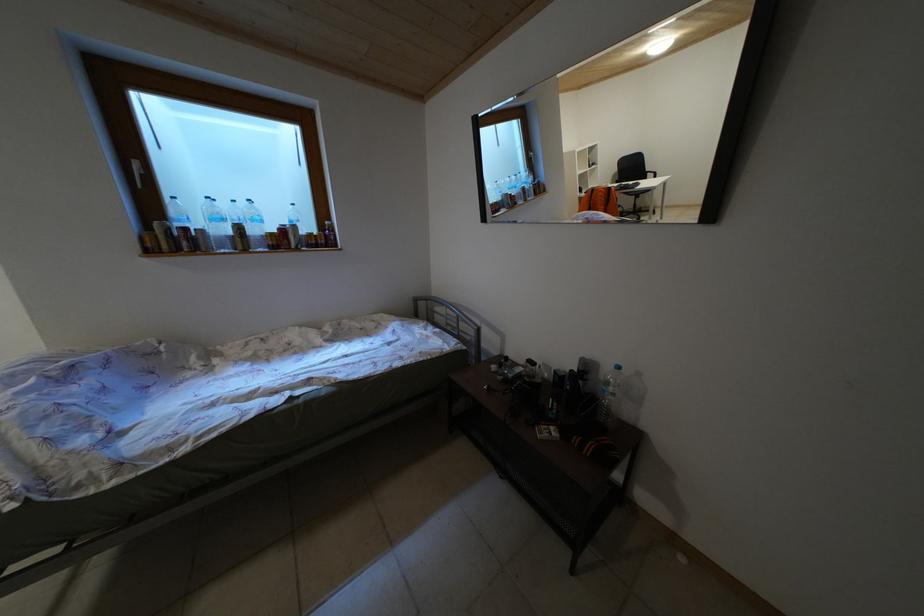
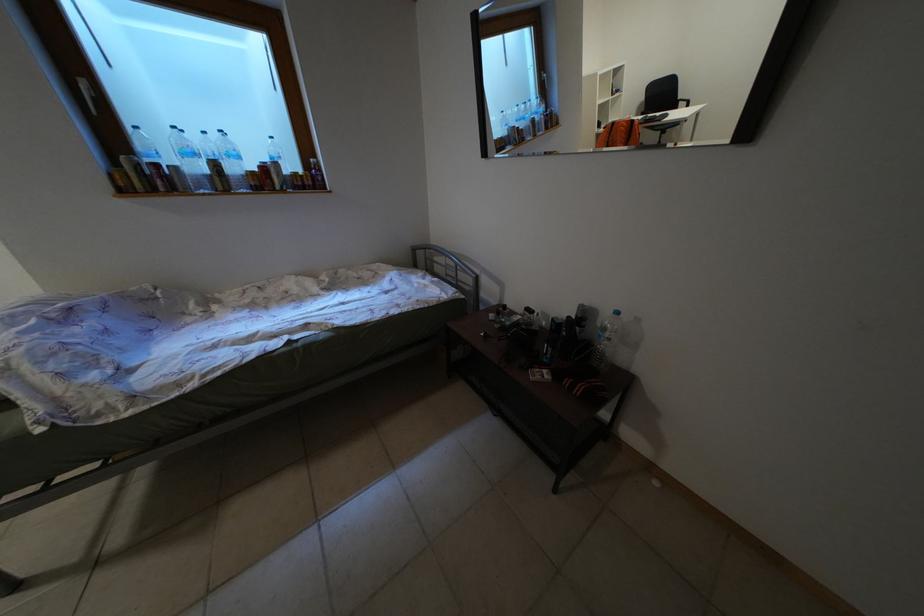
Question: The images are taken continuously from a first-person perspective. In which direction is your viewpoint rotating?

Choices:
 (A) Left
 (B) Right
 (C) Up
 (D) Down

Answer: (D)